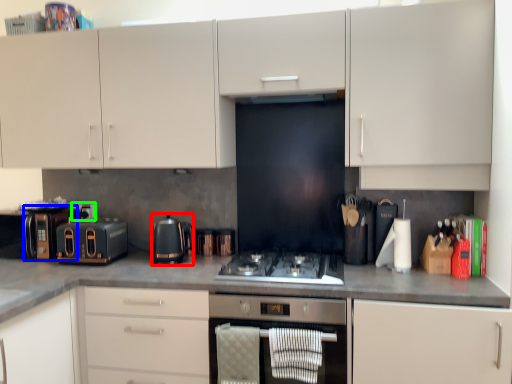
Question: Which is farther away from kitchen appliance (highlighted by a red box)? appliance (highlighted by a blue box) or appliance (highlighted by a green box)?

Choices:
 (A) appliance
 (B) appliance

Answer: (A)